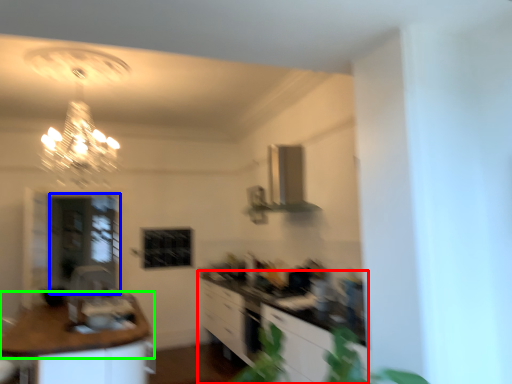
Question: Estimate the real-world distances between objects in this image. Which object is farther from cabinetry (highlighted by a red box), glass door (highlighted by a blue box) or countertop (highlighted by a green box)?

Choices:
 (A) glass door
 (B) countertop

Answer: (A)